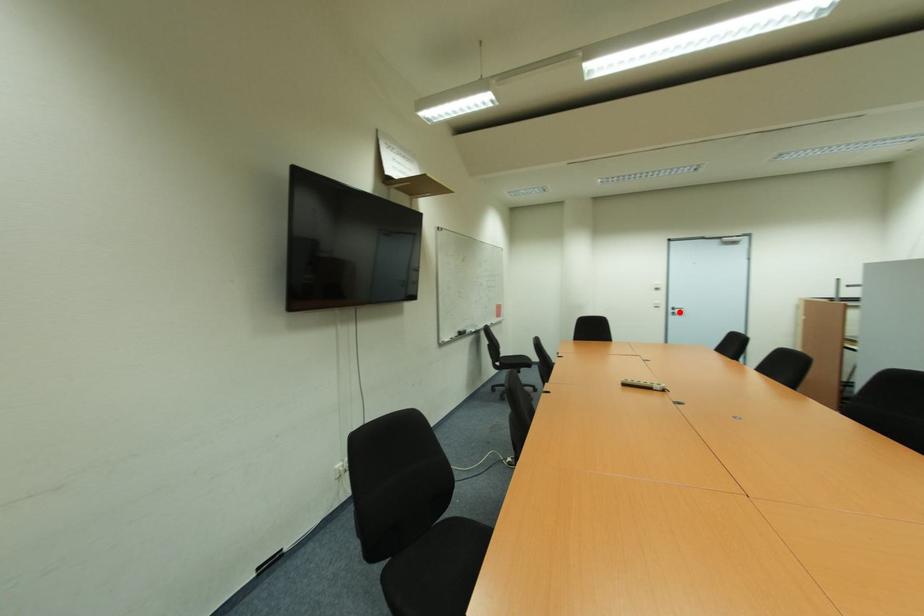
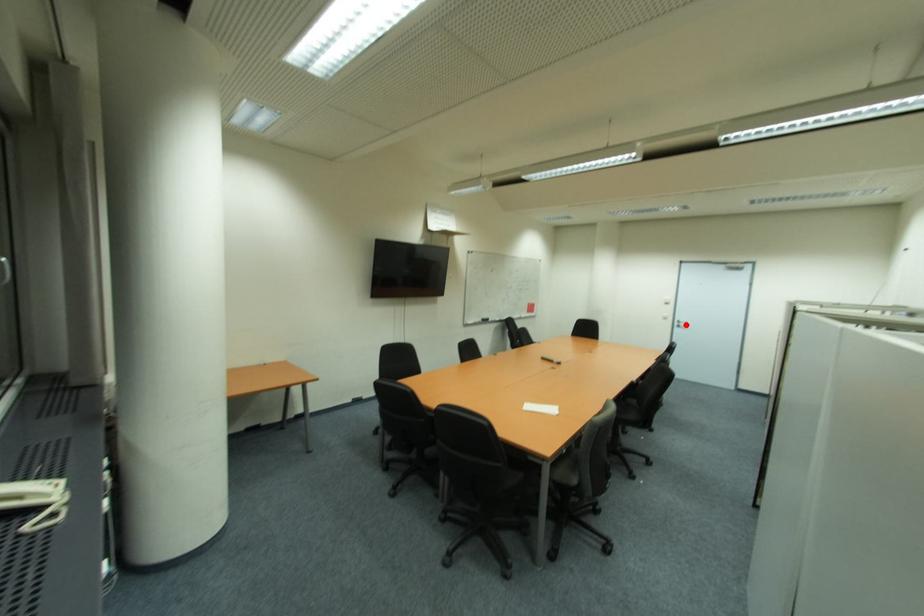
I am providing you with two images of the same scene from different viewpoints. A red point is marked on the first image and another point is marked on the second image. Does the point marked in image1 correspond to the same location as the one in image2?

Yes